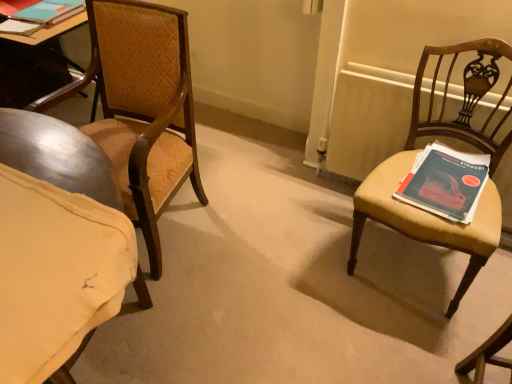
Question: Would you say wooden textured chair at left, which ranks as the second chair in right-to-left order, is to the left or to the right of wooden radiator at right in the picture?

Choices:
 (A) left
 (B) right

Answer: (A)

Question: From the image's perspective, is wooden textured chair at left, acting as the 1th chair starting from the left, located above or below wooden radiator at right?

Choices:
 (A) below
 (B) above

Answer: (B)

Question: Which object is positioned closest to the matte blue book at upper left, which is counted as the first book, starting from the back?

Choices:
 (A) wooden textured chair at left, which ranks as the second chair in right-to-left order
 (B) wooden radiator at right
 (C) matte blue book at right, which is the first book in bottom-to-top order
 (D) matte brown chair at right, arranged as the 2th chair when viewed from the left

Answer: (A)

Question: Considering the real-world distances, which object is farthest from the wooden radiator at right?

Choices:
 (A) wooden textured chair at left, acting as the 1th chair starting from the left
 (B) matte brown chair at right, arranged as the 2th chair when viewed from the left
 (C) matte blue book at upper left, the 1th book positioned from the left
 (D) matte blue book at right, the second book from the top

Answer: (C)